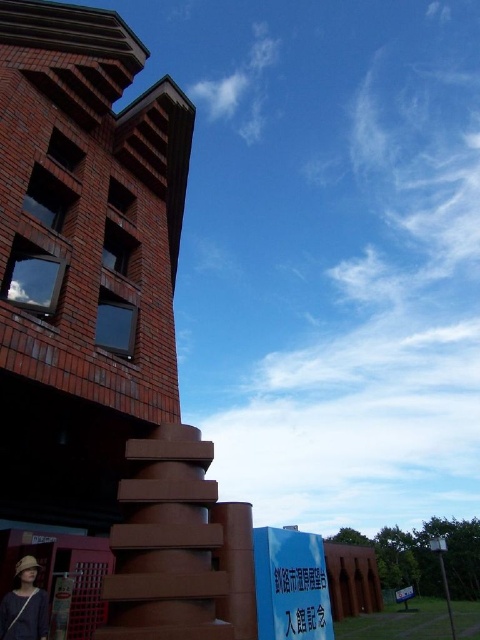
Does blue glossy sign at lower center appear on the left side of white plastic sign at lower right?

Indeed, blue glossy sign at lower center is positioned on the left side of white plastic sign at lower right.

Is point (311, 602) closer to viewer compared to point (409, 589)?

Yes, it is.

The height and width of the screenshot is (640, 480). Find the location of `blue glossy sign at lower center`. blue glossy sign at lower center is located at coordinates (290, 586).

Measure the distance between point (315, 561) and camera.

Point (315, 561) and camera are 12.30 meters apart.

Is point (261, 584) farther from camera compared to point (15, 596)?

Yes, point (261, 584) is behind point (15, 596).

Is point (304, 602) positioned after point (36, 624)?

That is True.

The image size is (480, 640). I want to click on blue glossy sign at lower center, so click(290, 586).

Between point (2, 612) and point (397, 595), which one is positioned in front?

Point (2, 612)

Can you confirm if matte brown hat at lower left is shorter than white plastic sign at lower right?

Yes.

Who is more distant from viewer, (9,609) or (411,595)?

The point (411,595) is behind.

This screenshot has width=480, height=640. I want to click on matte brown hat at lower left, so click(x=24, y=605).